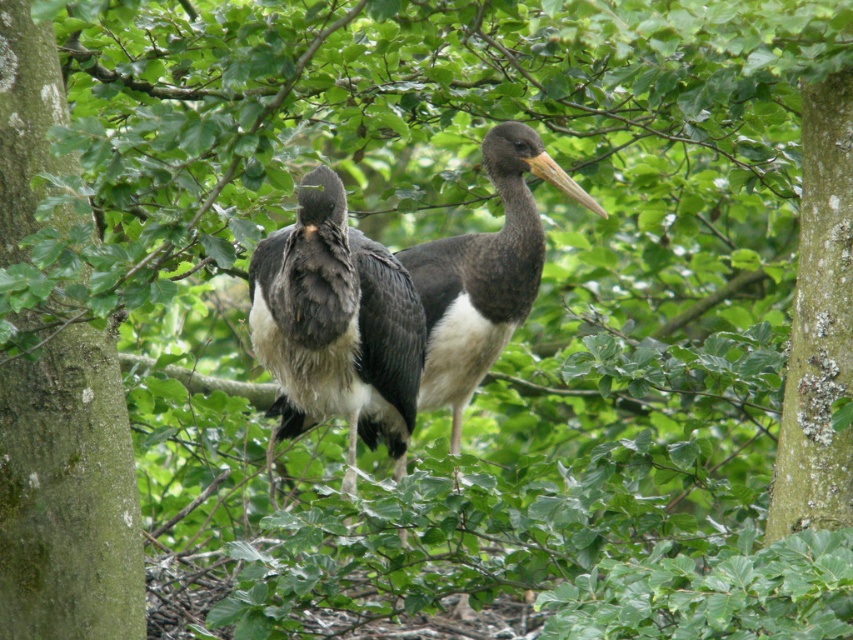
Between point (305, 340) and point (495, 326), which one is positioned in front?

Point (305, 340) is more forward.

Does dark gray feathers at center have a larger size compared to black glossy stork at center?

Yes, dark gray feathers at center is bigger than black glossy stork at center.

This screenshot has height=640, width=853. I want to click on dark gray feathers at center, so click(x=335, y=326).

Where is `dark gray feathers at center`? dark gray feathers at center is located at coordinates (335, 326).